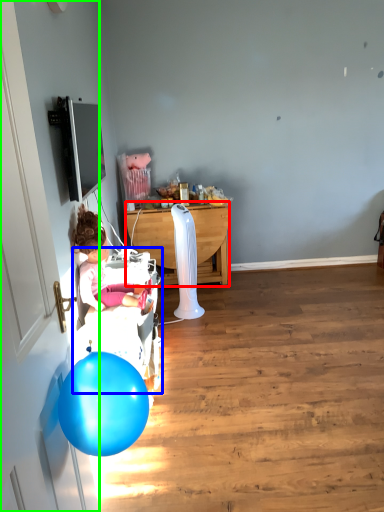
Question: Which is farther away from desk (highlighted by a red box)? baby carriage (highlighted by a blue box) or door (highlighted by a green box)?

Choices:
 (A) baby carriage
 (B) door

Answer: (B)